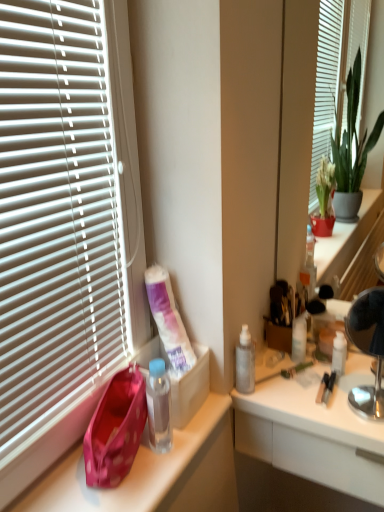
At what (x,y) coordinates should I click in order to perform the action: click on vacant space that is to the left of metallic silver lamp at right. Please return your answer as a coordinate pair (x, y). Looking at the image, I should click on (302, 399).